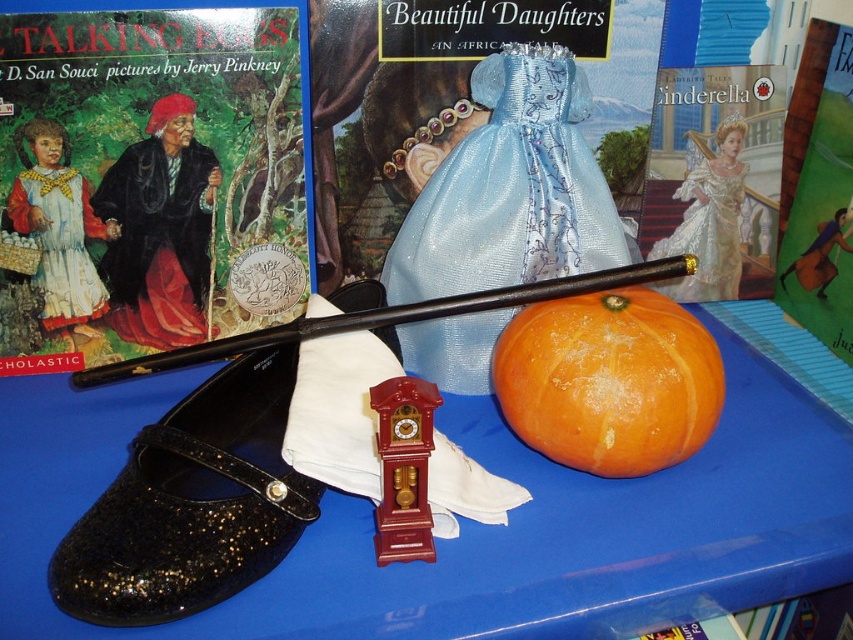
You are a fashion designer trying to decide which dress to feature in your next collection. You have two options in front of you on a blue surface. The shiny blue dress at center and the matte blue dress at center. Which dress is wider?

The shiny blue dress at center is wider than the matte blue dress at center according to the description.

You are organizing a fashion show and need to decide which dress to place first. The matte blue dress at center and silky blue dress at center are options. Based on their widths, which dress should you choose if you want the wider one first?

The silky blue dress at center is wider, so it should be placed first.